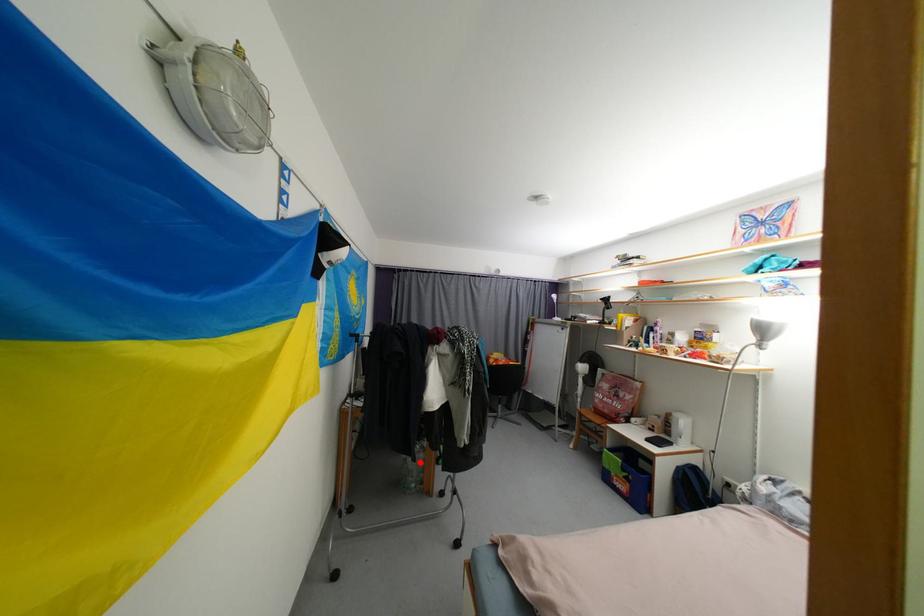
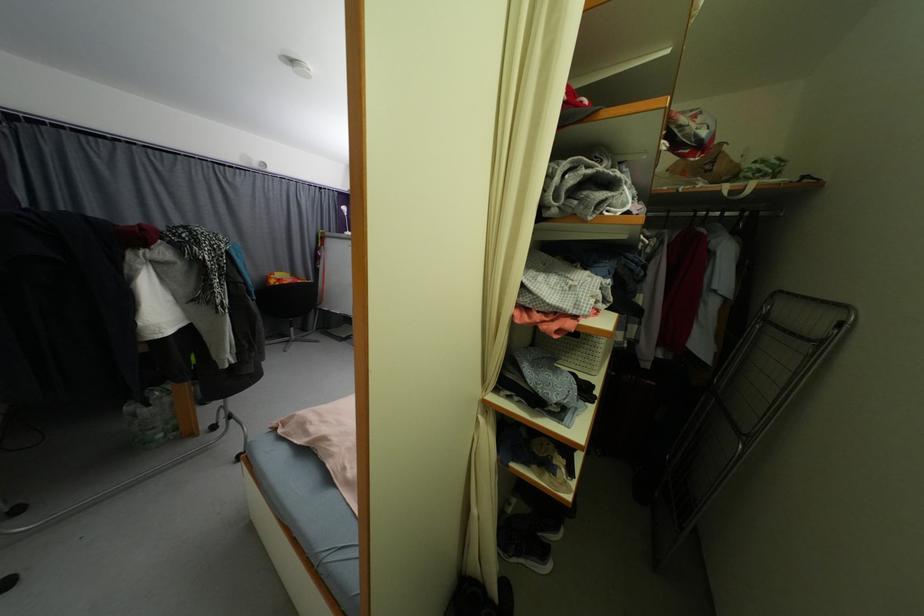
Find the pixel in the second image that matches the highlighted location in the first image.

(154, 407)